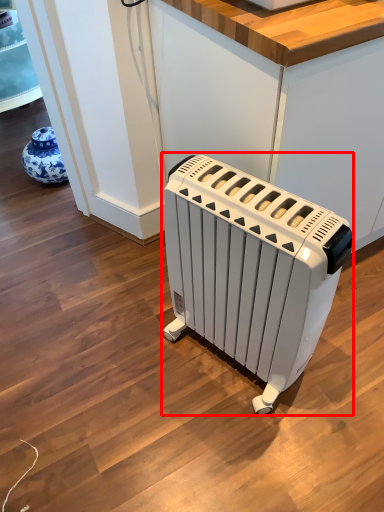
Question: From the image's perspective, what is the correct spatial relationship of home appliance (annotated by the red box) in relation to counter?

Choices:
 (A) above
 (B) below

Answer: (B)